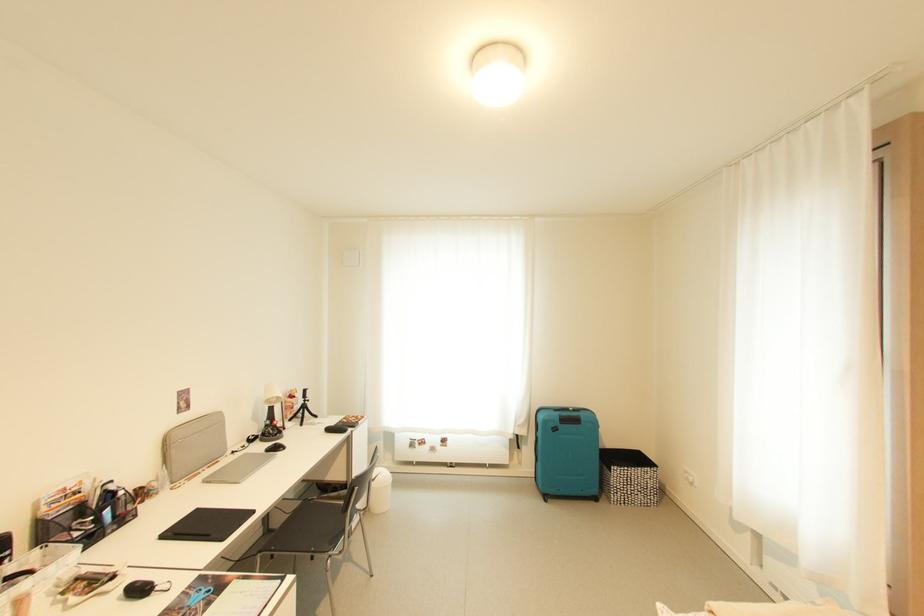
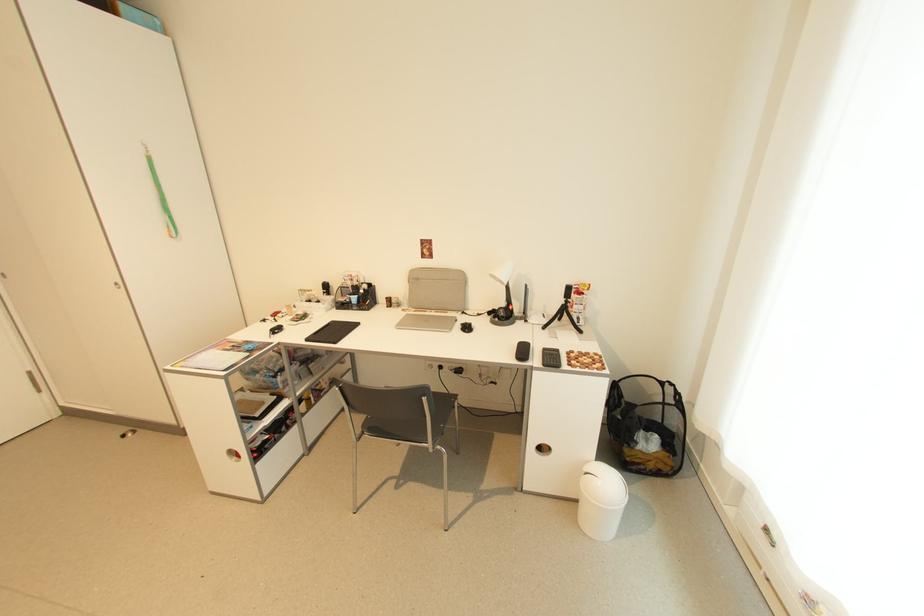
In the second image, find the point that corresponds to [310,403] in the first image.

(572, 302)